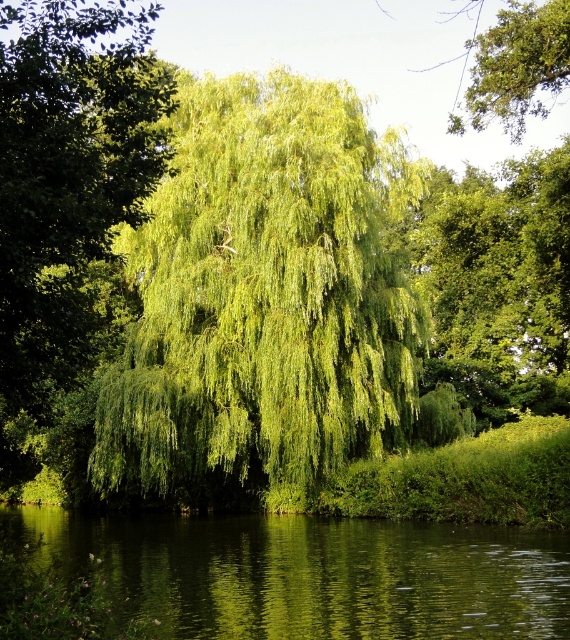
What do you see at coordinates (263, 301) in the screenshot? I see `green leafy willow at center` at bounding box center [263, 301].

Does green leafy willow at center appear under green reflective water at center?

Incorrect, green leafy willow at center is not positioned below green reflective water at center.

Locate an element on the screen. green leafy willow at center is located at coordinates (263, 301).